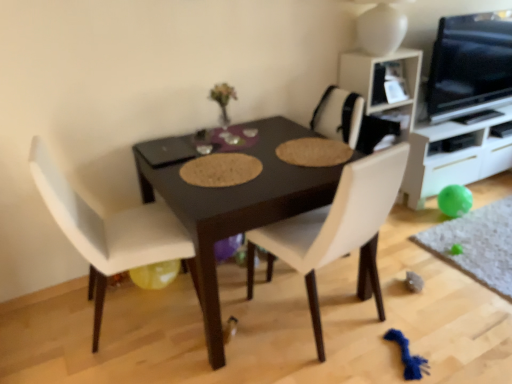
At what (x,y) coordinates should I click in order to perform the action: click on empty space that is in between white leather chair at center, the first chair positioned from the right, and dark wood table at center. Please return your answer as a coordinate pair (x, y). Looking at the image, I should click on (282, 359).